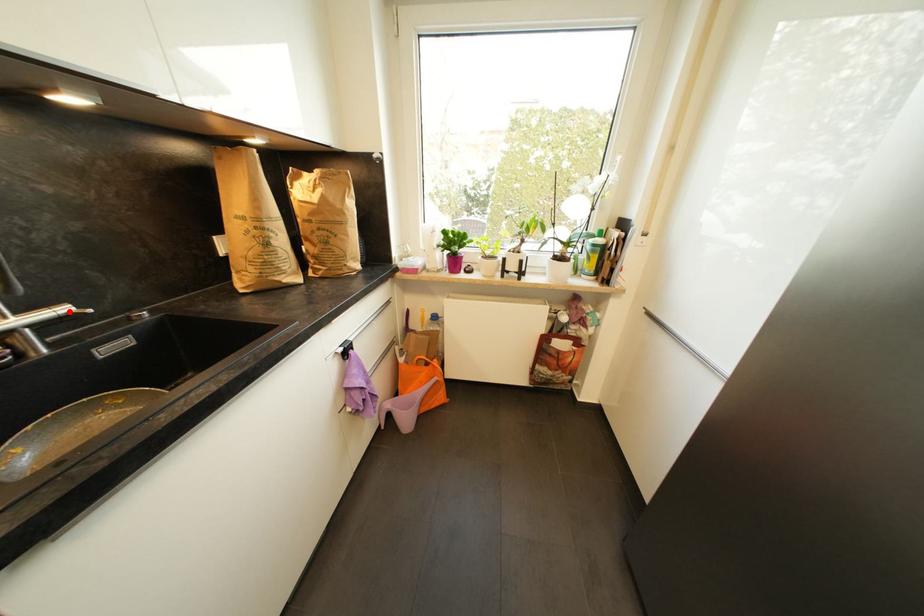
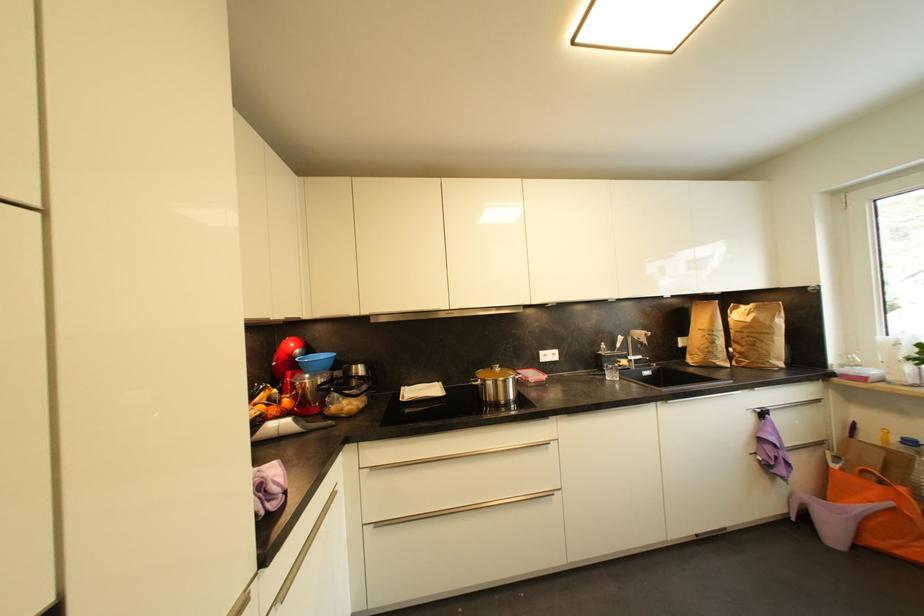
Question: I am providing you with two images of the same scene from different viewpoints. A red point is marked on the first image. Can you still see the location of the red point in image 2?

Choices:
 (A) Yes
 (B) No

Answer: (A)